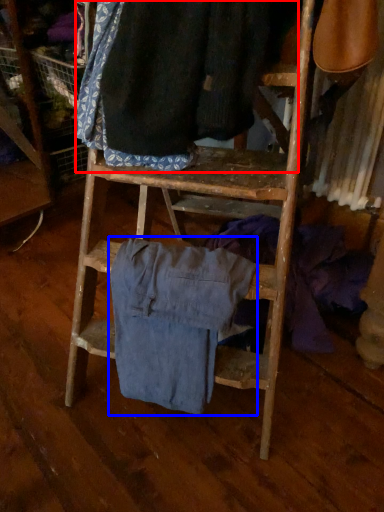
Question: Among these objects, which one is nearest to the camera, clothing (highlighted by a red box) or clothing (highlighted by a blue box)?

Choices:
 (A) clothing
 (B) clothing

Answer: (A)